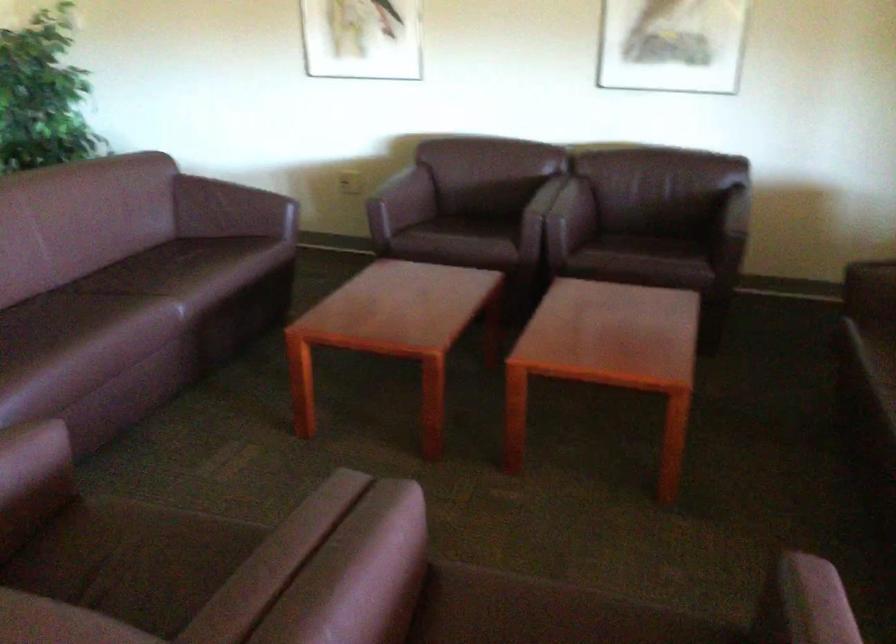
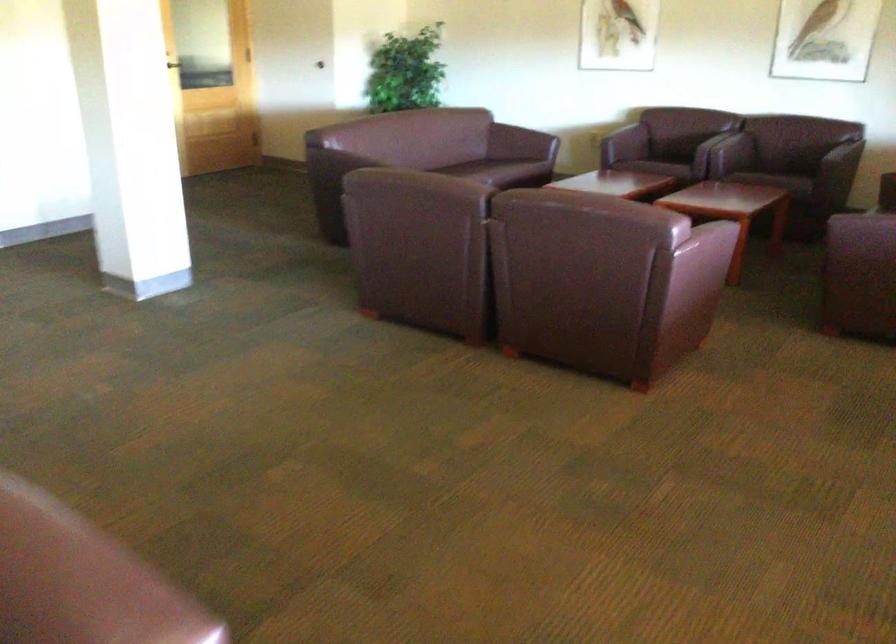
Question: What movement of the cameraman would produce the second image?

Choices:
 (A) Left
 (B) Right
 (C) Forward
 (D) Backward

Answer: (D)